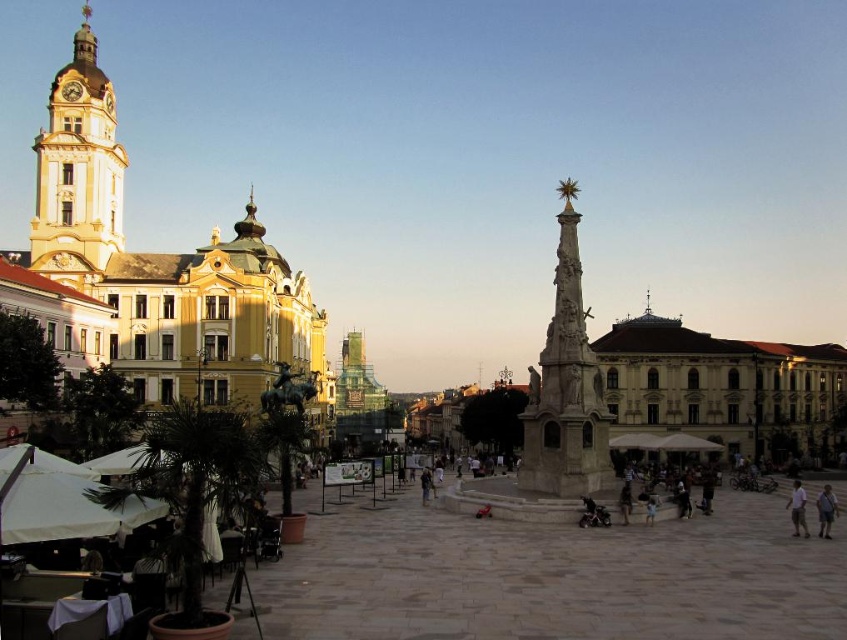
Does gold/yellow stone clock tower at upper left have a greater width compared to polished stone monument at center?

Yes, gold/yellow stone clock tower at upper left is wider than polished stone monument at center.

Find the location of `gold/yellow stone clock tower at upper left`. gold/yellow stone clock tower at upper left is located at coordinates (78, 172).

Identify the location of gold/yellow stone clock tower at upper left. This screenshot has width=847, height=640. (78, 172).

Between gold/yellow stone clock tower at upper left and light pink cotton shirt at lower right, which one is positioned higher?

Positioned higher is gold/yellow stone clock tower at upper left.

Is gold/yellow stone clock tower at upper left bigger than light pink cotton shirt at lower right?

Yes.

Image resolution: width=847 pixels, height=640 pixels. Describe the element at coordinates (78, 172) in the screenshot. I see `gold/yellow stone clock tower at upper left` at that location.

You are a GUI agent. You are given a task and a screenshot of the screen. Output one action in this format:
    pyautogui.click(x=<x>, y=<y>)
    Task: Click on the gold/yellow stone clock tower at upper left
    This screenshot has height=640, width=847.
    Given the screenshot: What is the action you would take?
    pyautogui.click(x=78, y=172)

Between point (104, 243) and point (818, 515), which one is positioned in front?

Point (818, 515)

Based on the photo, which is more to the right, gold/yellow stone clock tower at upper left or light blue shirt at center?

light blue shirt at center is more to the right.

Measure the distance between point (119, 211) and camera.

Point (119, 211) and camera are 393.84 feet apart from each other.

This screenshot has width=847, height=640. Identify the location of gold/yellow stone clock tower at upper left. coord(78,172).